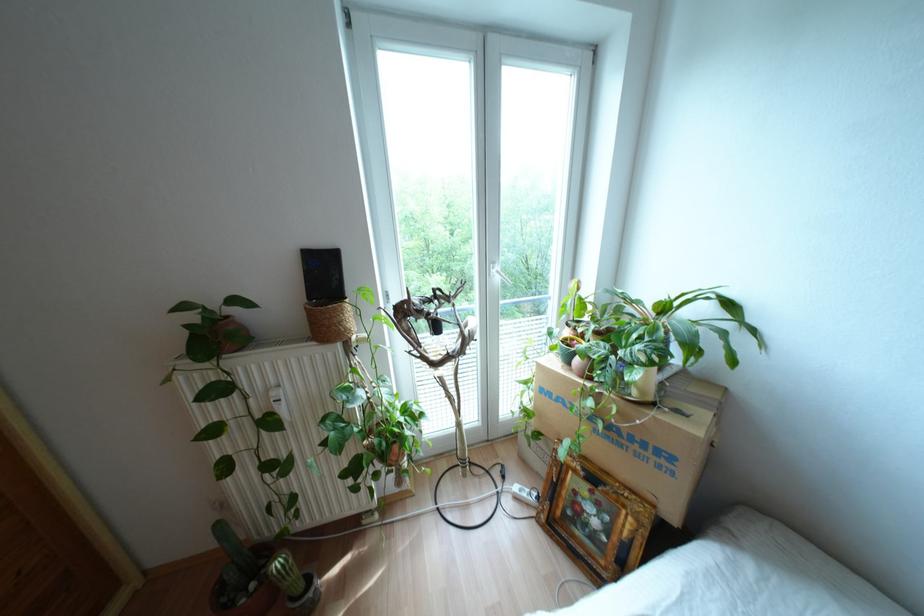
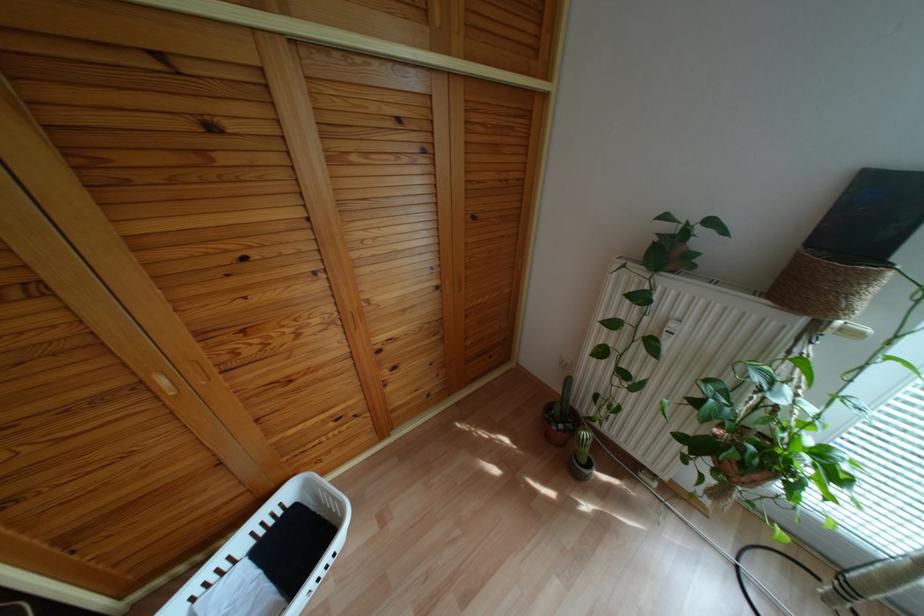
The point at [395,447] is marked in the first image. Where is the corresponding point in the second image?

(763, 474)